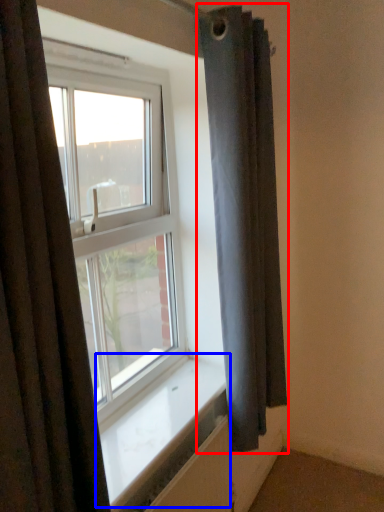
Question: Which object is closer to the camera taking this photo, curtain (highlighted by a red box) or window sill (highlighted by a blue box)?

Choices:
 (A) curtain
 (B) window sill

Answer: (B)